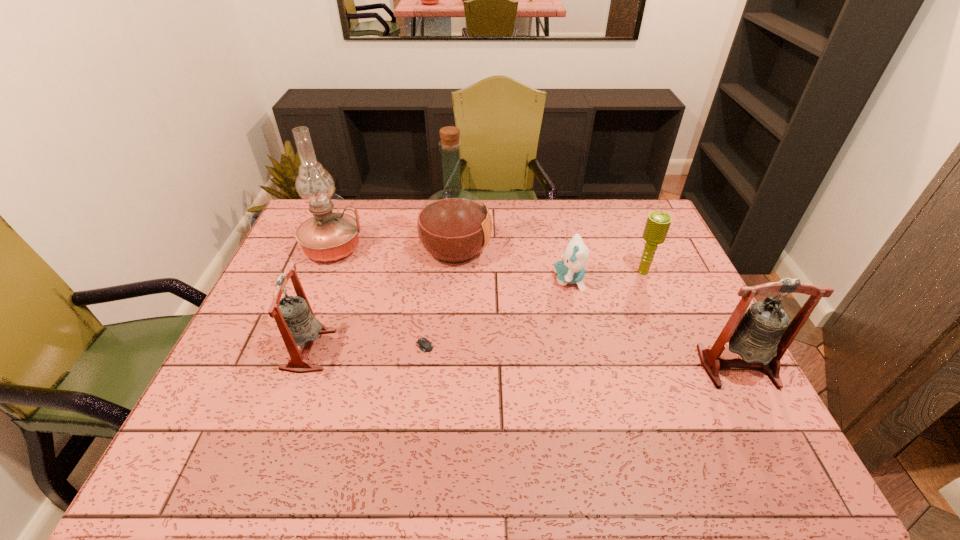
Find the location of a particular element. The image size is (960, 540). the second object from right to left is located at coordinates (657, 225).

Find the location of a particular element. vacant space situated on the right of the left bell is located at coordinates point(358,350).

At what (x,y) coordinates should I click in order to perform the action: click on vacant space situated 0.060m on the back of the right bell. Please return your answer as a coordinate pair (x, y). This screenshot has width=960, height=540. Looking at the image, I should click on (717, 328).

The width and height of the screenshot is (960, 540). Identify the location of vacant space located on the front of the oil lamp. (299, 337).

At what (x,y) coordinates should I click in order to perform the action: click on blank space located 0.190m on the face of the kitten. Please return your answer as a coordinate pair (x, y). Image resolution: width=960 pixels, height=540 pixels. Looking at the image, I should click on (492, 279).

This screenshot has height=540, width=960. Find the location of `blank area located 0.380m on the face of the kitten`. blank area located 0.380m on the face of the kitten is located at coordinates (429, 279).

Where is `free space located 0.360m on the face of the kitten`? The width and height of the screenshot is (960, 540). free space located 0.360m on the face of the kitten is located at coordinates pyautogui.click(x=435, y=279).

Locate an element on the screen. The width and height of the screenshot is (960, 540). blank space located 0.250m on the front label of the liquor is located at coordinates (568, 249).

The width and height of the screenshot is (960, 540). Find the location of `vacant space positioned 0.340m on the back of the shortest object`. vacant space positioned 0.340m on the back of the shortest object is located at coordinates (432, 247).

At what (x,y) coordinates should I click in order to perform the action: click on free spot located on the left of the third shortest object. Please return your answer as a coordinate pair (x, y). Image resolution: width=960 pixels, height=540 pixels. Looking at the image, I should click on (613, 273).